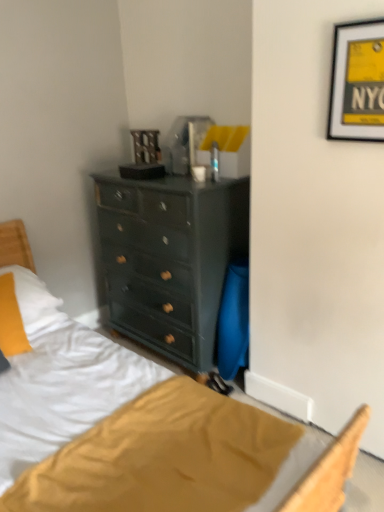
Question: Which is correct: black matte picture frame at upper right is inside soft yellow pillow at lower left, or outside of it?

Choices:
 (A) outside
 (B) inside

Answer: (A)

Question: Is point (367, 123) positioned closer to the camera than point (6, 333)?

Choices:
 (A) farther
 (B) closer

Answer: (B)

Question: Considering the positions of black matte picture frame at upper right and soft yellow pillow at lower left in the image, is black matte picture frame at upper right wider or thinner than soft yellow pillow at lower left?

Choices:
 (A) thin
 (B) wide

Answer: (A)

Question: Is soft yellow pillow at lower left situated inside black matte picture frame at upper right or outside?

Choices:
 (A) inside
 (B) outside

Answer: (B)

Question: Is soft yellow pillow at lower left wider or thinner than black matte picture frame at upper right?

Choices:
 (A) thin
 (B) wide

Answer: (B)

Question: Considering the relative positions of soft yellow pillow at lower left and black matte picture frame at upper right in the image provided, is soft yellow pillow at lower left to the left or to the right of black matte picture frame at upper right?

Choices:
 (A) left
 (B) right

Answer: (A)

Question: From a real-world perspective, is soft yellow pillow at lower left above or below black matte picture frame at upper right?

Choices:
 (A) below
 (B) above

Answer: (A)